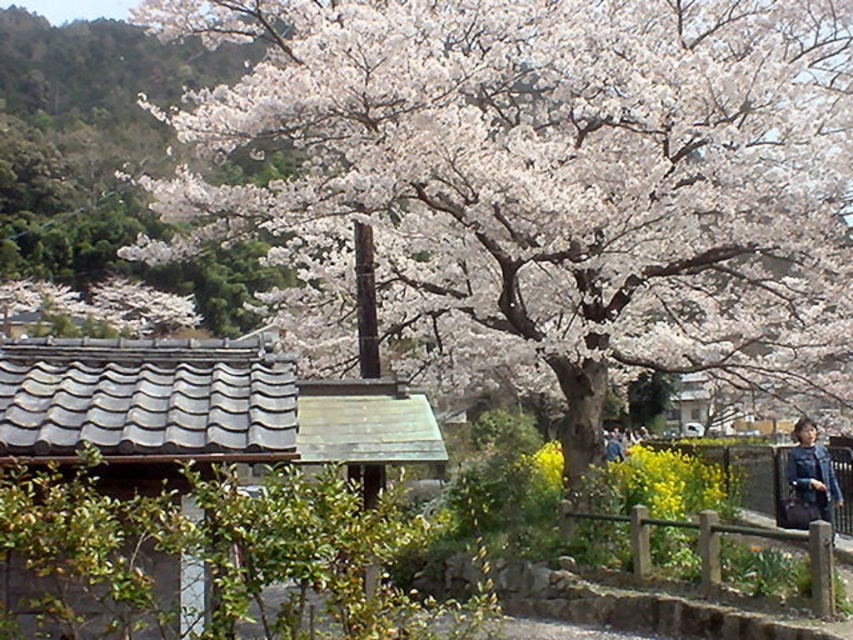
From the picture: You are standing at the point marked as point (555, 170). What do you see directly in front of you?

You see white blossoms at center directly in front of you at point (555, 170).

You are standing in the scene and want to take a photo of the white blossoms at center. Where should you aim your camera to capture them?

You should aim your camera at point (555,170) to capture the white blossoms at center.